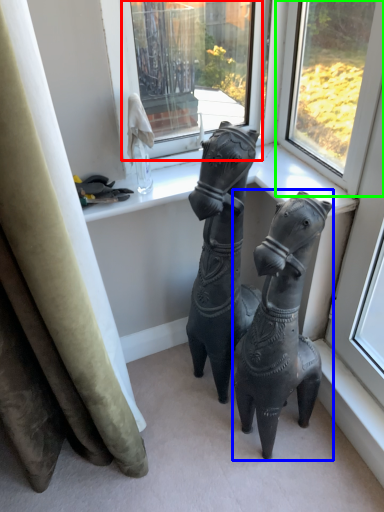
Question: Which object is positioned closest to window (highlighted by a red box)? Select from horse (highlighted by a blue box) and window (highlighted by a green box).

Choices:
 (A) horse
 (B) window

Answer: (B)